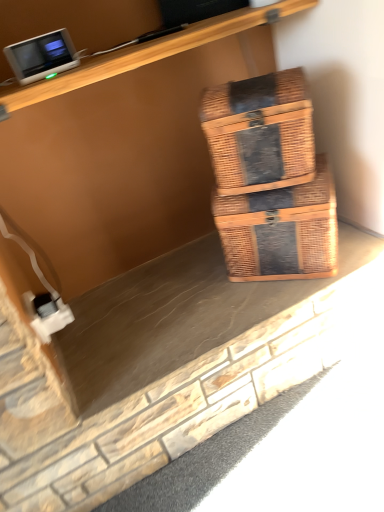
Question: Does woven brown box at center, arranged as the 2th box when ordered from the bottom, have a lesser width compared to woven brown box at center, which ranks as the 1th box in bottom-to-top order?

Choices:
 (A) yes
 (B) no

Answer: (A)

Question: Does woven brown box at center, arranged as the 2th box when ordered from the bottom, appear on the right side of woven brown box at center, which is counted as the 2th box, starting from the top?

Choices:
 (A) no
 (B) yes

Answer: (A)

Question: Is woven brown box at center, which appears as the first box when viewed from the top, bigger than woven brown box at center, which is counted as the 2th box, starting from the top?

Choices:
 (A) no
 (B) yes

Answer: (A)

Question: Is woven brown box at center, which appears as the first box when viewed from the top, closer to the viewer compared to woven brown box at center, which is counted as the 2th box, starting from the top?

Choices:
 (A) yes
 (B) no

Answer: (A)

Question: From a real-world perspective, is woven brown box at center, which appears as the first box when viewed from the top, beneath woven brown box at center, which ranks as the 1th box in bottom-to-top order?

Choices:
 (A) no
 (B) yes

Answer: (A)

Question: Can we say woven brown box at center, arranged as the 2th box when ordered from the bottom, lies outside woven brown box at center, which is counted as the 2th box, starting from the top?

Choices:
 (A) yes
 (B) no

Answer: (A)

Question: Considering the relative positions of woven brown box at center, which ranks as the 1th box in bottom-to-top order, and matte gray monitor at upper left in the image provided, is woven brown box at center, which ranks as the 1th box in bottom-to-top order, behind matte gray monitor at upper left?

Choices:
 (A) no
 (B) yes

Answer: (B)

Question: Is woven brown box at center, which is counted as the 2th box, starting from the top, positioned in front of matte gray monitor at upper left?

Choices:
 (A) yes
 (B) no

Answer: (B)

Question: Does woven brown box at center, which is counted as the 2th box, starting from the top, have a lesser width compared to matte gray monitor at upper left?

Choices:
 (A) yes
 (B) no

Answer: (B)

Question: From a real-world perspective, is woven brown box at center, which is counted as the 2th box, starting from the top, on top of matte gray monitor at upper left?

Choices:
 (A) yes
 (B) no

Answer: (B)

Question: Is woven brown box at center, which is counted as the 2th box, starting from the top, taller than matte gray monitor at upper left?

Choices:
 (A) no
 (B) yes

Answer: (B)

Question: Is woven brown box at center, which ranks as the 1th box in bottom-to-top order, completely or partially outside of matte gray monitor at upper left?

Choices:
 (A) no
 (B) yes

Answer: (B)

Question: From a real-world perspective, does white plastic electric outlet at lower left sit lower than woven brown box at center, which ranks as the 1th box in bottom-to-top order?

Choices:
 (A) yes
 (B) no

Answer: (A)